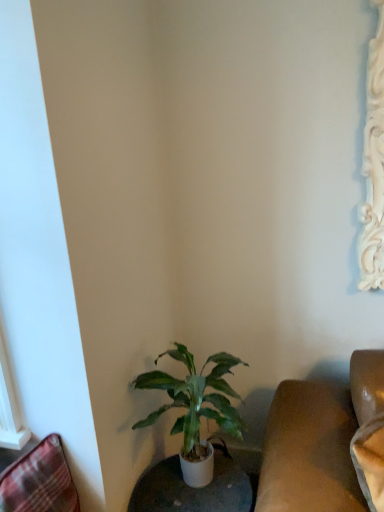
Question: Is white glossy round table at lower center situated inside green matte plant at lower center or outside?

Choices:
 (A) outside
 (B) inside

Answer: (A)

Question: From their relative heights in the image, would you say white glossy round table at lower center is taller or shorter than green matte plant at lower center?

Choices:
 (A) short
 (B) tall

Answer: (A)

Question: Which is nearer to the plaid fabric swivel chair at lower left?

Choices:
 (A) green matte plant at lower center
 (B) white glossy round table at lower center

Answer: (A)

Question: Considering the real-world distances, which object is closest to the plaid fabric swivel chair at lower left?

Choices:
 (A) white glossy round table at lower center
 (B) green matte plant at lower center

Answer: (B)